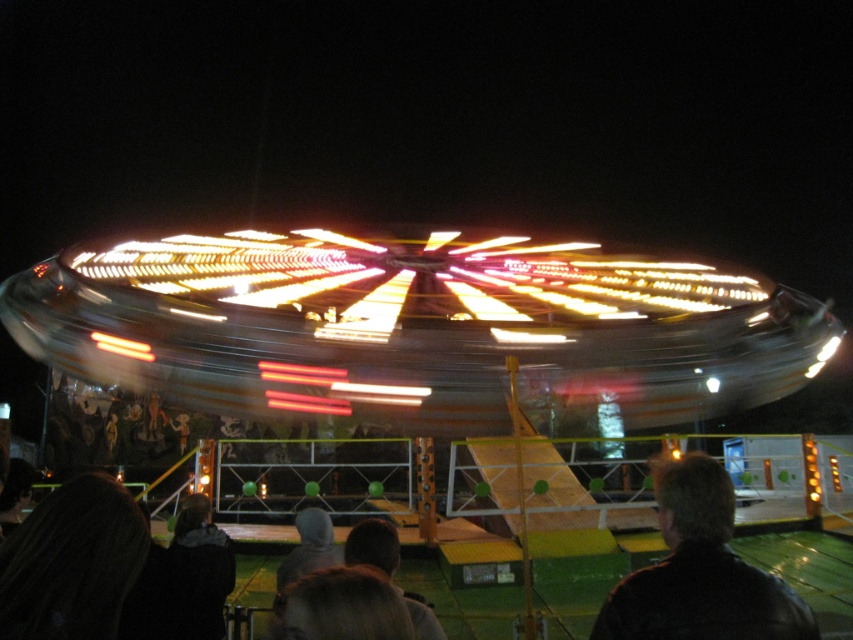
Question: Which of the following is the closest to the observer?

Choices:
 (A) (204, 524)
 (B) (807, 637)
 (C) (38, 516)

Answer: (B)

Question: Can you confirm if dark hair at lower left is positioned above dark gray hoodie at lower left?

Choices:
 (A) no
 (B) yes

Answer: (B)

Question: Which point appears farthest from the camera in this image?

Choices:
 (A) (688, 456)
 (B) (131, 554)
 (C) (790, 381)

Answer: (C)

Question: Is metallic shiny carousel at center bigger than dark gray hoodie at lower left?

Choices:
 (A) yes
 (B) no

Answer: (A)

Question: Considering the relative positions of black leather jacket at center and dark gray hoodie at lower left in the image provided, where is black leather jacket at center located with respect to dark gray hoodie at lower left?

Choices:
 (A) right
 (B) left

Answer: (A)

Question: Which of the following is the farthest from the observer?

Choices:
 (A) (781, 396)
 (B) (728, 600)
 (C) (70, 584)

Answer: (A)